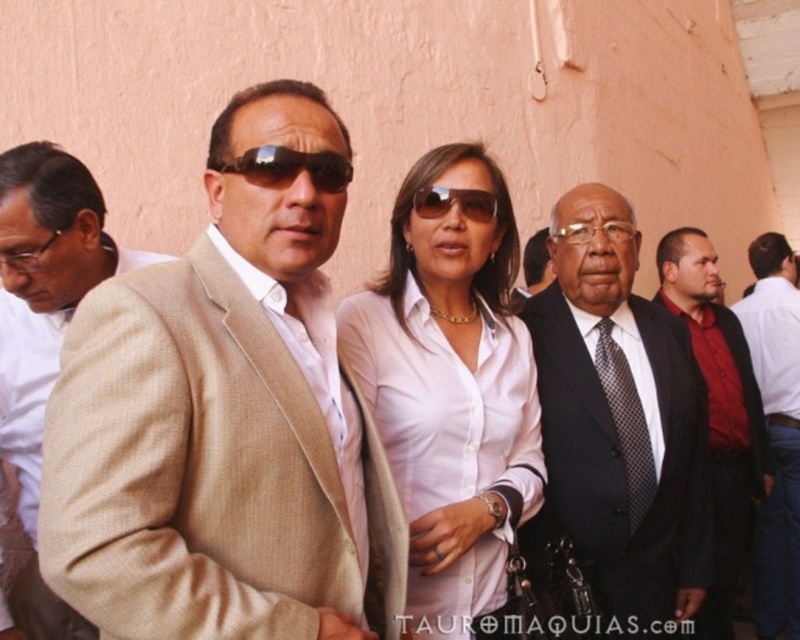
You are a photographer at a formal event. You need to adjust your camera to focus on the beige textured suit at center and the dark blue suit at center. Which suit is closer to the camera?

The beige textured suit at center is closer to the camera since it is in front of the dark blue suit at center.

You are a photographer trying to capture a group photo of the scene. The camera is set up at the origin point. Where should you focus your camera to ensure the dark blue suit at center is in the frame?

The dark blue suit at center is located at point (622, 435), so you should focus your camera at that coordinate to ensure it is in the frame.